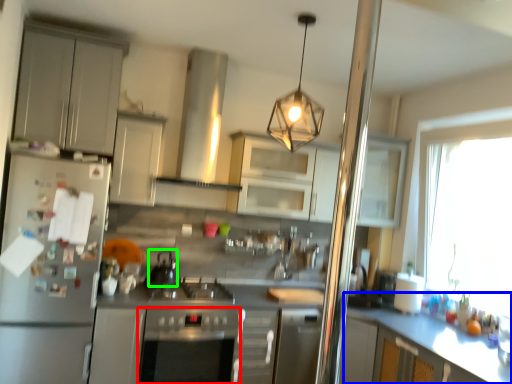
Question: Which object is the closest to the oven (highlighted by a red box)? Choose among these: counter (highlighted by a blue box) or appliance (highlighted by a green box).

Choices:
 (A) counter
 (B) appliance

Answer: (B)